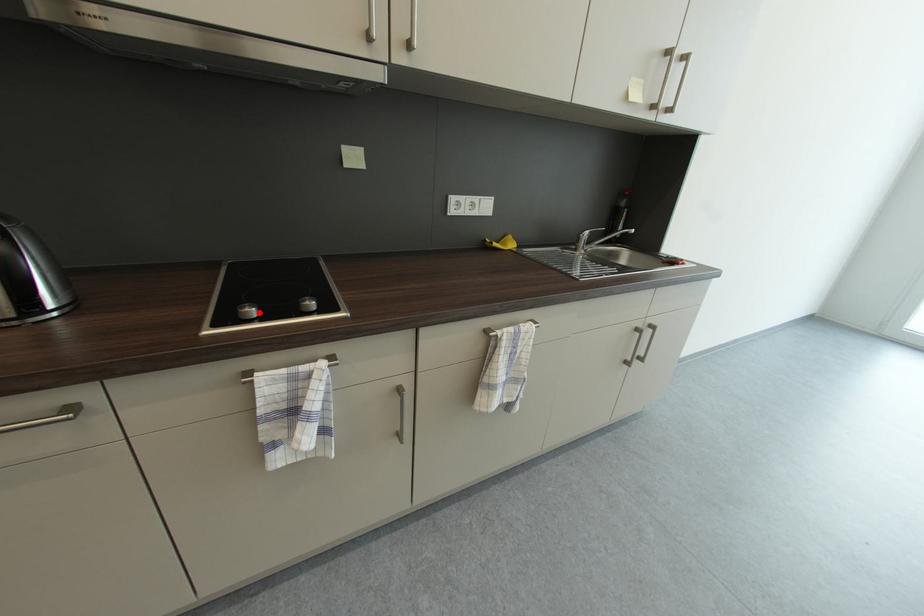
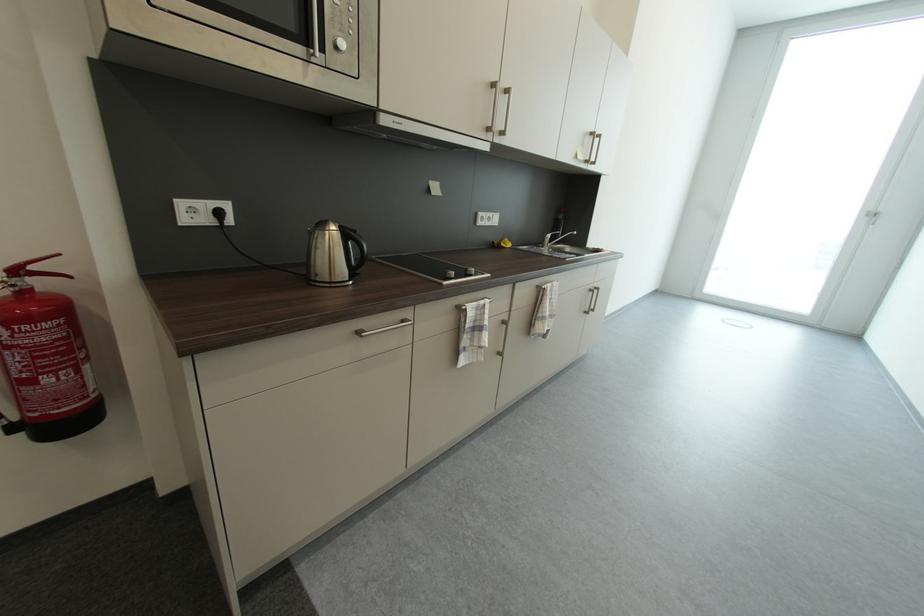
Find the pixel in the second image that matches the highlighted location in the first image.

(458, 275)